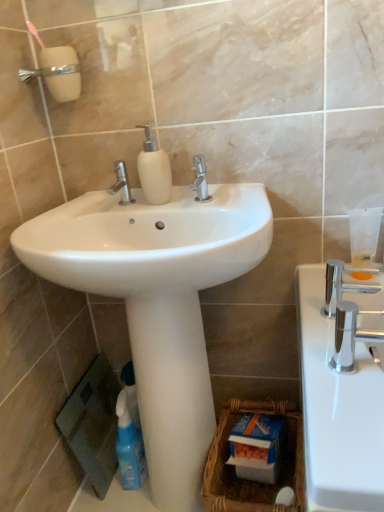
Question: Is white glossy pedestal at center turned away from white matte soap dispenser at center?

Choices:
 (A) yes
 (B) no

Answer: (B)

Question: Are white glossy pedestal at center and white matte soap dispenser at center far apart?

Choices:
 (A) yes
 (B) no

Answer: (B)

Question: From a real-world perspective, is white glossy pedestal at center physically above white matte soap dispenser at center?

Choices:
 (A) no
 (B) yes

Answer: (A)

Question: From the image's perspective, is white glossy pedestal at center above white matte soap dispenser at center?

Choices:
 (A) no
 (B) yes

Answer: (A)

Question: From a real-world perspective, is white glossy pedestal at center physically below white matte soap dispenser at center?

Choices:
 (A) no
 (B) yes

Answer: (B)

Question: From the image's perspective, would you say white glossy pedestal at center is shown under white matte soap dispenser at center?

Choices:
 (A) yes
 (B) no

Answer: (A)

Question: Is blue plastic spray bottle at lower left not within polished chrome faucet at center, which is counted as the first tap, starting from the top?

Choices:
 (A) no
 (B) yes

Answer: (B)

Question: Considering the relative positions of blue plastic spray bottle at lower left and polished chrome faucet at center, the 2th tap positioned from the right, in the image provided, is blue plastic spray bottle at lower left in front of polished chrome faucet at center, the 2th tap positioned from the right,?

Choices:
 (A) no
 (B) yes

Answer: (A)

Question: Is blue plastic spray bottle at lower left surrounding polished chrome faucet at center, which is counted as the first tap, starting from the top?

Choices:
 (A) no
 (B) yes

Answer: (A)

Question: Can you confirm if blue plastic spray bottle at lower left is taller than polished chrome faucet at center, which is the second tap in back-to-front order?

Choices:
 (A) yes
 (B) no

Answer: (A)

Question: Considering the relative sizes of blue plastic spray bottle at lower left and polished chrome faucet at center, the 2th tap when ordered from front to back, in the image provided, is blue plastic spray bottle at lower left wider than polished chrome faucet at center, the 2th tap when ordered from front to back,?

Choices:
 (A) no
 (B) yes

Answer: (B)

Question: Is blue plastic spray bottle at lower left to the right of polished chrome faucet at center, positioned as the third tap in bottom-to-top order, from the viewer's perspective?

Choices:
 (A) no
 (B) yes

Answer: (A)

Question: Considering the relative sizes of white matte soap dispenser at center and polished chrome faucet at center, positioned as the third tap in bottom-to-top order, in the image provided, is white matte soap dispenser at center thinner than polished chrome faucet at center, positioned as the third tap in bottom-to-top order,?

Choices:
 (A) yes
 (B) no

Answer: (A)